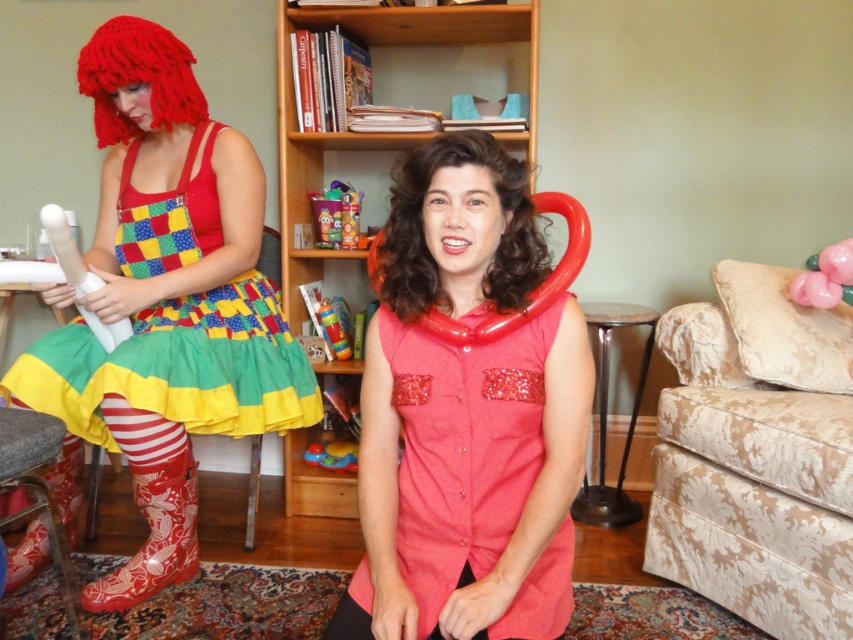
You are standing in a living room and want to place a new painting on the wall behind the wooden bookshelf at center and the rubberized plastic cup at center. Which object should you move first to access the wall?

You should move the wooden bookshelf at center first because it is closer to the viewer than the rubberized plastic cup at center, so moving it first will allow you to access the wall behind both objects.

You are a furniture designer who wants to place a new floor lamp in the living room. The lamp is 1.8 meters tall. Considering the height of the velvet beige armchair at right and the curly brown hair at center, will the lamp be taller than both objects?

The velvet beige armchair at right is taller than curly brown hair at center. Since the armchair is taller and the lamp is 1.8 meters tall, the lamp will be taller than both the velvet beige armchair at right and the curly brown hair at center.